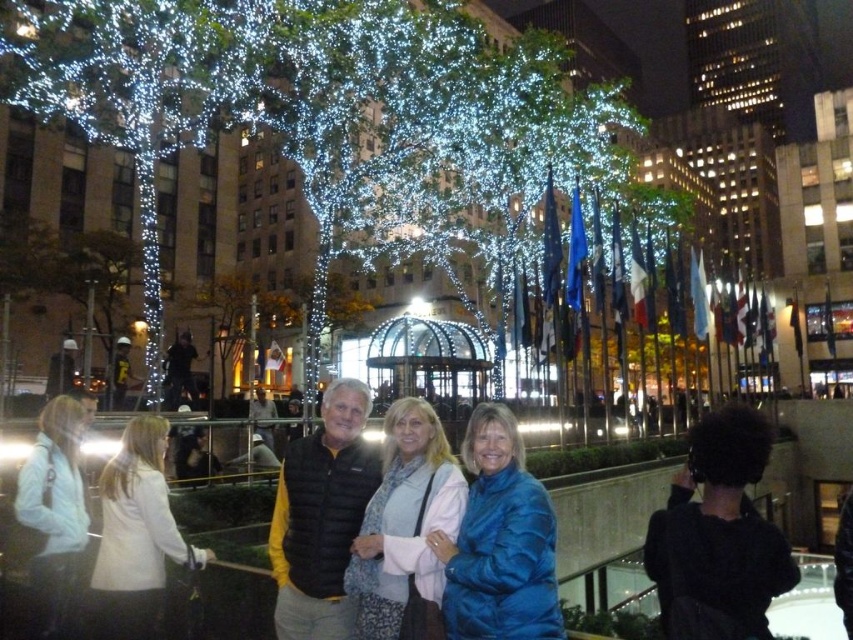
Question: Is black fabric at right thinner than black puffer vest at center?

Choices:
 (A) no
 (B) yes

Answer: (B)

Question: Is black puffer vest at center in front of matte black vest at center?

Choices:
 (A) no
 (B) yes

Answer: (A)

Question: Which point is closer to the camera?

Choices:
 (A) (160, 534)
 (B) (296, 531)
 (C) (459, 193)

Answer: (A)

Question: Which object appears farthest from the camera in this image?

Choices:
 (A) matte black vest at center
 (B) black fabric at right
 (C) illuminated glass tree at center

Answer: (C)

Question: Which object is the farthest from the matte black vest at center?

Choices:
 (A) black fabric at right
 (B) illuminated glass tree at center
 (C) blue shiny jacket at center
 (D) black puffer vest at center

Answer: (B)

Question: Does illuminated glass tree at center appear on the left side of white fabric jacket at lower left?

Choices:
 (A) yes
 (B) no

Answer: (B)